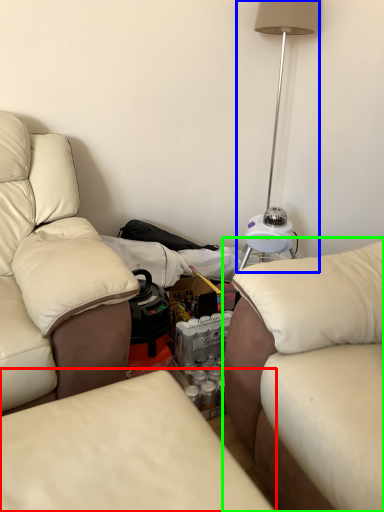
Question: Estimate the real-world distances between objects in this image. Which object is farther from studio couch (highlighted by a red box), table lamp (highlighted by a blue box) or studio couch (highlighted by a green box)?

Choices:
 (A) table lamp
 (B) studio couch

Answer: (A)